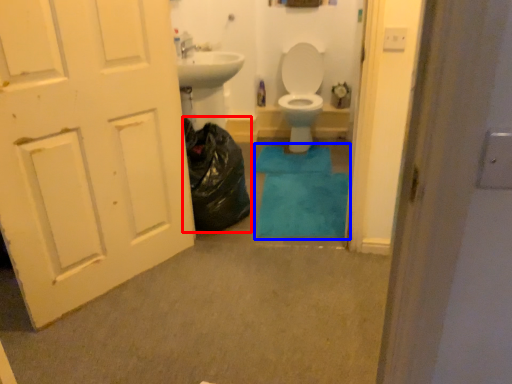
Question: Which of the following is the farthest to the observer, garbage (highlighted by a red box) or bath mat (highlighted by a blue box)?

Choices:
 (A) garbage
 (B) bath mat

Answer: (B)